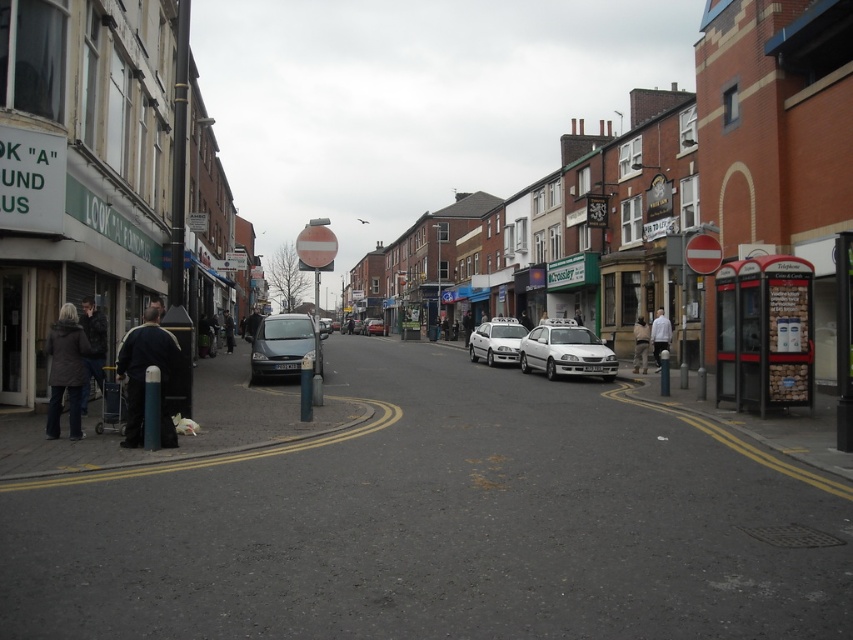
Question: Does white matte car at center come in front of white fabric jacket at center?

Choices:
 (A) no
 (B) yes

Answer: (A)

Question: Among these objects, which one is farthest from the camera?

Choices:
 (A) white fabric jacket at center
 (B) dark brown leather jacket at lower left
 (C) satin silver car at center

Answer: (A)

Question: Which object appears closest to the camera in this image?

Choices:
 (A) satin silver car at center
 (B) matte gray car at center

Answer: (B)

Question: Can you confirm if satin silver car at center is bigger than white matte car at center?

Choices:
 (A) yes
 (B) no

Answer: (A)

Question: Does white metallic car at center have a greater width compared to white fabric jacket at center?

Choices:
 (A) no
 (B) yes

Answer: (B)

Question: Which point appears farthest from the camera in this image?

Choices:
 (A) (259, 362)
 (B) (148, 356)
 (C) (82, 355)

Answer: (A)